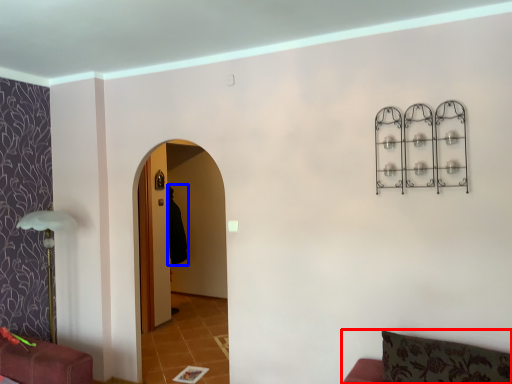
Question: Among these objects, which one is farthest to the camera, furniture (highlighted by a red box) or robe (highlighted by a blue box)?

Choices:
 (A) furniture
 (B) robe

Answer: (B)